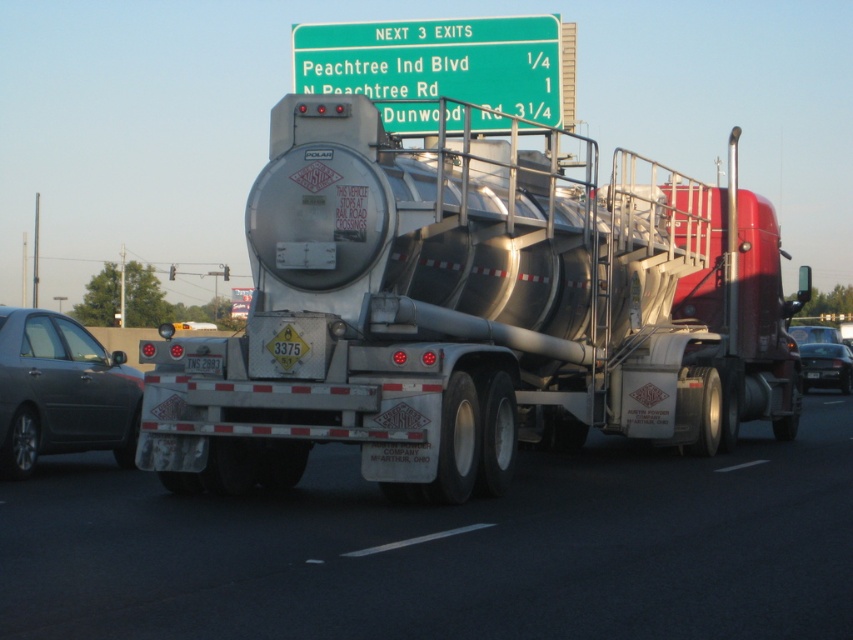
You are a driver approaching an intersection where the silver metallic tanker truck at center and the black glossy sedan at lower right are both present. Based on their positions, which vehicle is closer to the intersection?

The black glossy sedan at lower right is closer to the intersection because the silver metallic tanker truck at center is to the left of it, meaning the sedan is positioned further ahead along the road.

You are a traffic officer observing a highway scene. You notice a silver metallic tanker truck at center and a metallic gray sedan at left. Which vehicle is positioned lower in the image?

The silver metallic tanker truck at center is located below the metallic gray sedan at left, so it is positioned lower in the image.

You are a traffic officer observing a tanker truck on the highway. You notice a metallic gray sedan at left and a black plastic license plate at rear. Which object is nearer to your viewpoint?

The metallic gray sedan at left is closer to the viewer than the black plastic license plate at rear.